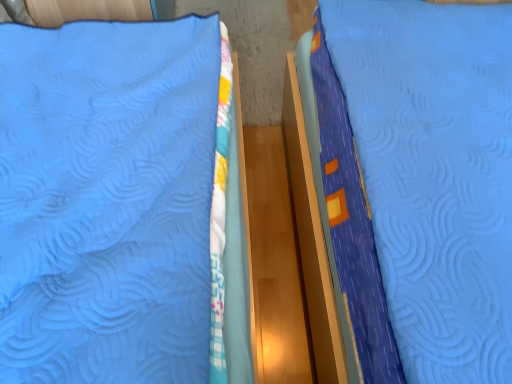
The image size is (512, 384). I want to click on matte blue quilt at center, so click(x=415, y=184).

This screenshot has width=512, height=384. Describe the element at coordinates (415, 184) in the screenshot. I see `matte blue quilt at center` at that location.

This screenshot has width=512, height=384. I want to click on matte blue quilt at center, so click(415, 184).